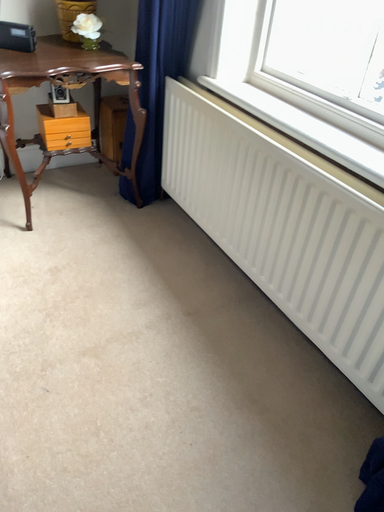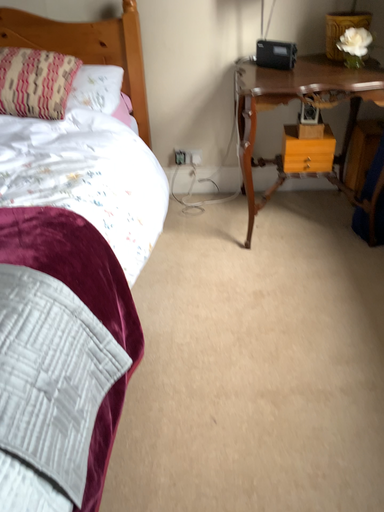
Question: Which way did the camera rotate in the video?

Choices:
 (A) rotated upward
 (B) rotated downward

Answer: (A)